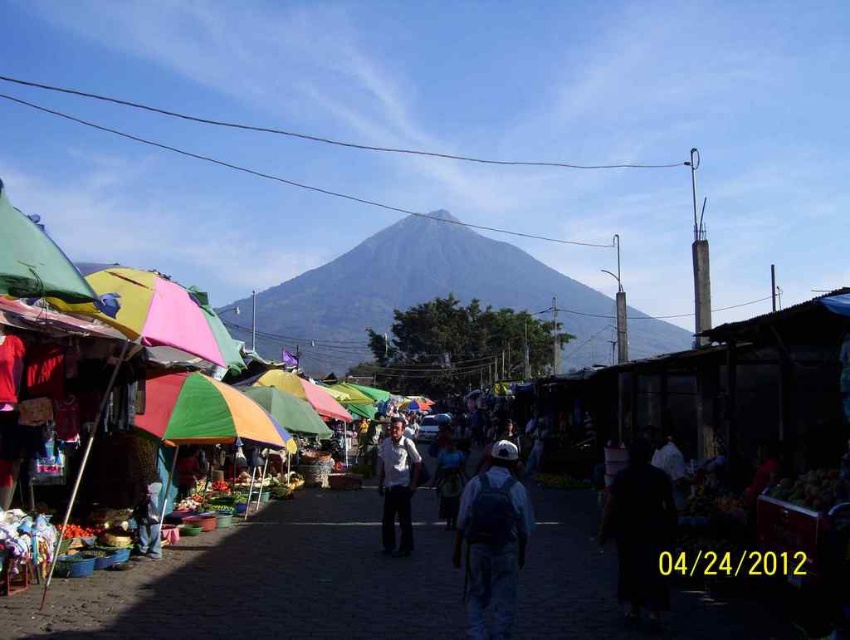
Who is more forward, (616, 577) or (37, 257)?

Point (37, 257) is more forward.

Which is behind, point (633, 593) or point (86, 301)?

The point (633, 593) is behind.

This screenshot has width=850, height=640. Find the location of `black matte person at center`. black matte person at center is located at coordinates (639, 531).

Who is positioned more to the right, gray matte mountain at center or black matte person at center?

Positioned to the right is black matte person at center.

Between gray matte mountain at center and black matte person at center, which one is positioned higher?

gray matte mountain at center is above.

Who is more distant from viewer, (440, 253) or (642, 566)?

The point (440, 253) is behind.

Locate an element on the screen. gray matte mountain at center is located at coordinates (415, 294).

Is gray matte mountain at center closer to the viewer compared to dark gray backpack at center?

No.

Image resolution: width=850 pixels, height=640 pixels. In order to click on gray matte mountain at center in this screenshot , I will do `click(415, 294)`.

Find the location of a particular element. gray matte mountain at center is located at coordinates (415, 294).